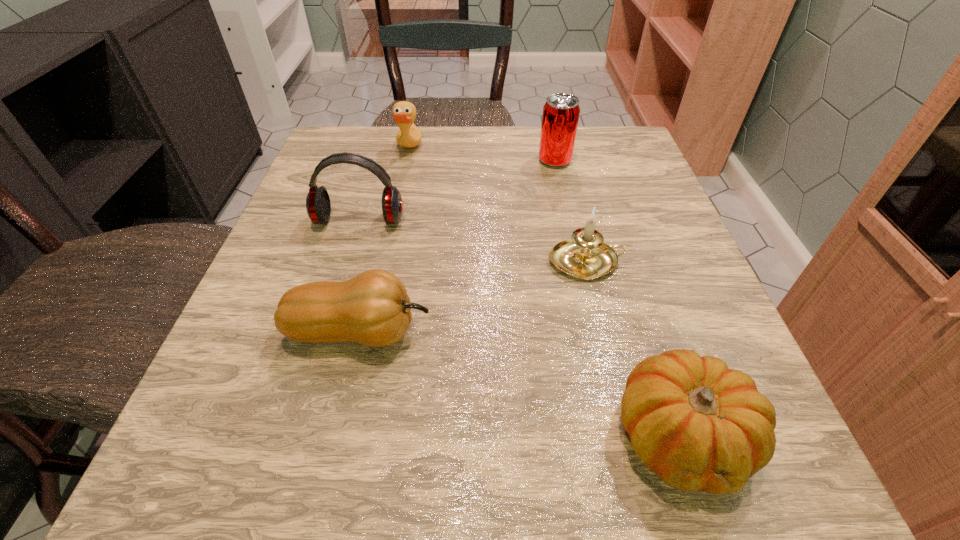
Locate an element on the screen. free space between the duck and the candle holder is located at coordinates (498, 206).

Locate an element on the screen. Image resolution: width=960 pixels, height=540 pixels. empty space between the fourth nearest object and the third nearest object is located at coordinates (473, 241).

In order to click on vacant area that lies between the duck and the soda can in this screenshot , I will do `click(482, 156)`.

You are a GUI agent. You are given a task and a screenshot of the screen. Output one action in this format:
    pyautogui.click(x=<x>, y=<y>)
    Task: Click on the empty space that is in between the soda can and the earphone
    
    Given the screenshot: What is the action you would take?
    pyautogui.click(x=457, y=191)

Locate an element on the screen. This screenshot has width=960, height=540. empty space that is in between the left gourd and the duck is located at coordinates (384, 241).

Locate an element on the screen. unoccupied position between the nearest object and the duck is located at coordinates (545, 293).

Where is `empty space that is in between the soda can and the duck`? This screenshot has width=960, height=540. empty space that is in between the soda can and the duck is located at coordinates (482, 156).

Image resolution: width=960 pixels, height=540 pixels. What are the coordinates of `unoccupied position between the candle holder and the second nearest object` in the screenshot? It's located at (473, 297).

Find the location of a particular element. The height and width of the screenshot is (540, 960). object that is the fifth closest to the right gourd is located at coordinates (404, 113).

Select which object appears as the fourth closest to the third nearest object. Please provide its 2D coordinates. Your answer should be formatted as a tuple, i.e. [(x, y)], where the tuple contains the x and y coordinates of a point satisfying the conditions above.

[(318, 206)]